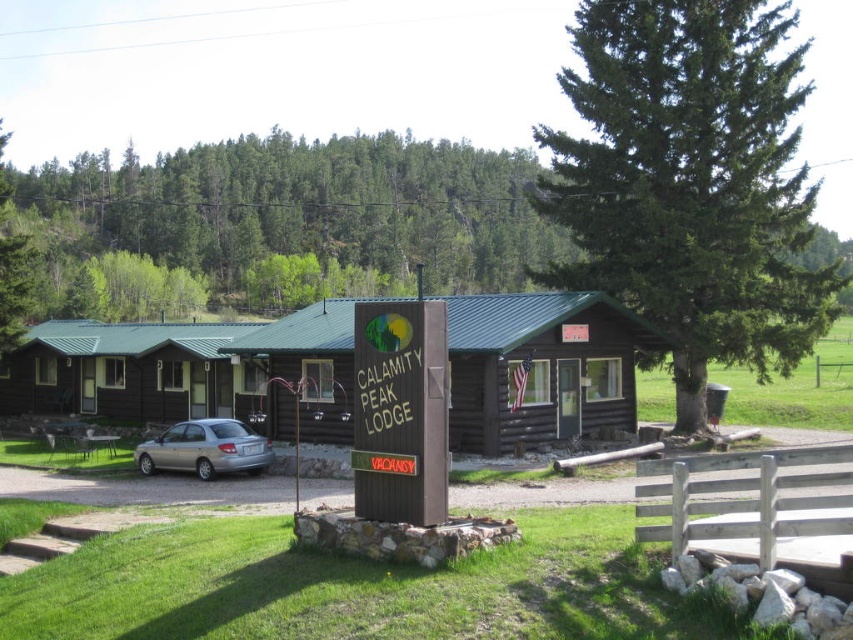
You are standing in front of the Calamity Peak Lodge and want to take a photo of both the green coniferous tree at center and the brown log cabin at left. Which object should you position to your left side to include both in the frame?

To include both the green coniferous tree at center and the brown log cabin at left in the frame, position the brown log cabin at left to your left side since it is to the left of the green coniferous tree at center.

You are standing at the entrance of the Calamity Peak Lodge and notice a green coniferous tree at center. Can you determine its exact position relative to the entrance?

The green coniferous tree at center is located at point coordinates of (691,182). This means the tree is positioned slightly to the left and lower portion of the entrance area relative to the overall image frame.

You are a guest arriving at Calamity Peak Lodge and need to park your car. You see the satin silver sedan at lower left and the brown wooden picnic table at lower left. Which object is closer to the entrance of the lodge?

The satin silver sedan at lower left is located above the brown wooden picnic table at lower left, meaning it is closer to the entrance of the lodge since it is positioned higher in the image.